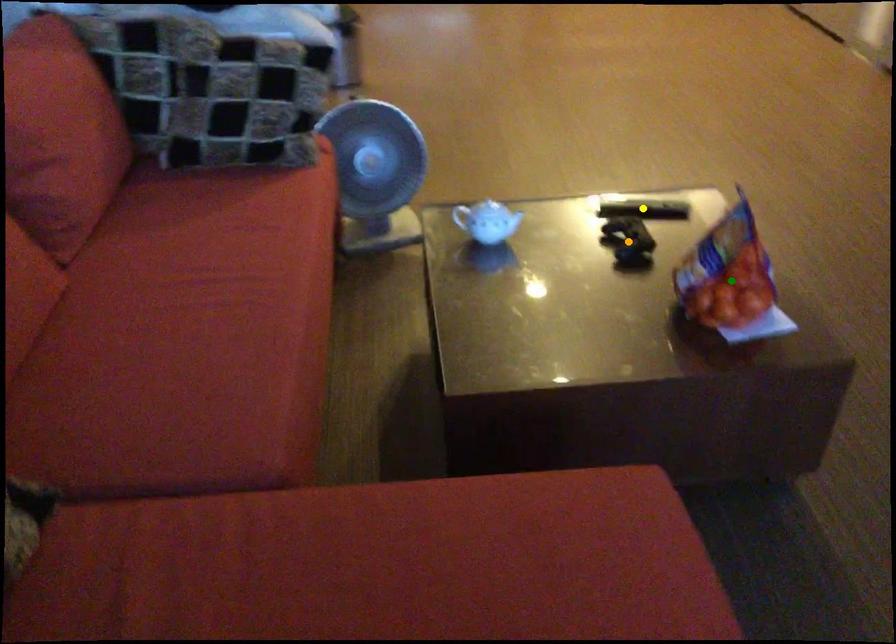
Order these from nearest to farthest:
1. orange point
2. green point
3. yellow point

green point, orange point, yellow point